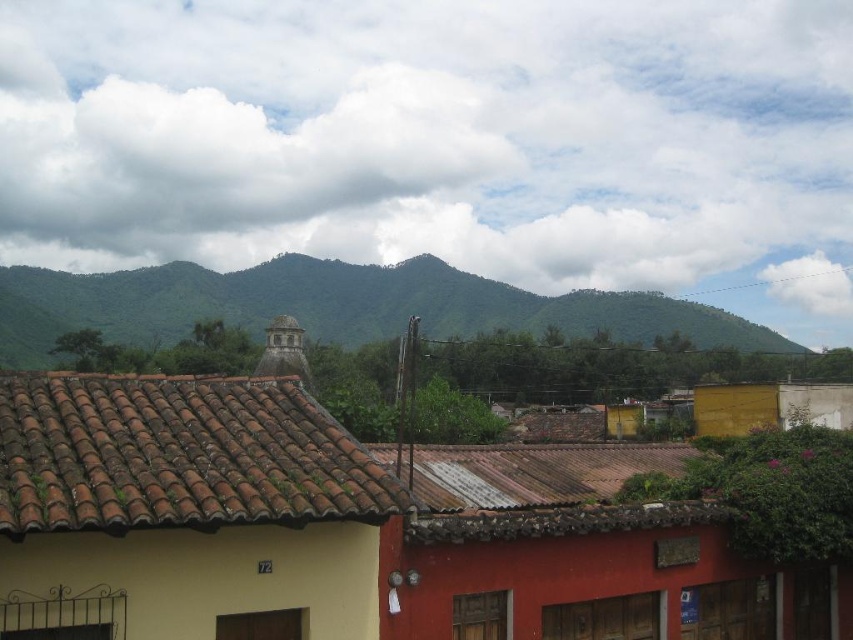
Is the position of brown clay tiles at upper left more distant than that of green leafy mountains at upper center?

No, it is in front of green leafy mountains at upper center.

Measure the distance between brown clay tiles at upper left and camera.

brown clay tiles at upper left is 27.78 feet away from camera.

The image size is (853, 640). Find the location of `brown clay tiles at upper left`. brown clay tiles at upper left is located at coordinates (177, 454).

Between white fluffy cloud at upper center and brown clay tiles at upper left, which one has less height?

With less height is brown clay tiles at upper left.

Between point (421, 241) and point (258, 435), which one is positioned in front?

Positioned in front is point (258, 435).

At what (x,y) coordinates should I click in order to perform the action: click on white fluffy cloud at upper center. Please return your answer as a coordinate pair (x, y). Looking at the image, I should click on (440, 140).

Can you confirm if white fluffy cloud at upper center is positioned above green leafy mountains at upper center?

Correct, white fluffy cloud at upper center is located above green leafy mountains at upper center.

Does white fluffy cloud at upper center have a greater height compared to green leafy mountains at upper center?

Yes, white fluffy cloud at upper center is taller than green leafy mountains at upper center.

Which is in front, point (664, 54) or point (103, 310)?

Point (103, 310) is more forward.

You are a GUI agent. You are given a task and a screenshot of the screen. Output one action in this format:
    pyautogui.click(x=<x>, y=<y>)
    Task: Click on the white fluffy cloud at upper center
    The image size is (853, 640).
    Given the screenshot: What is the action you would take?
    pyautogui.click(x=440, y=140)